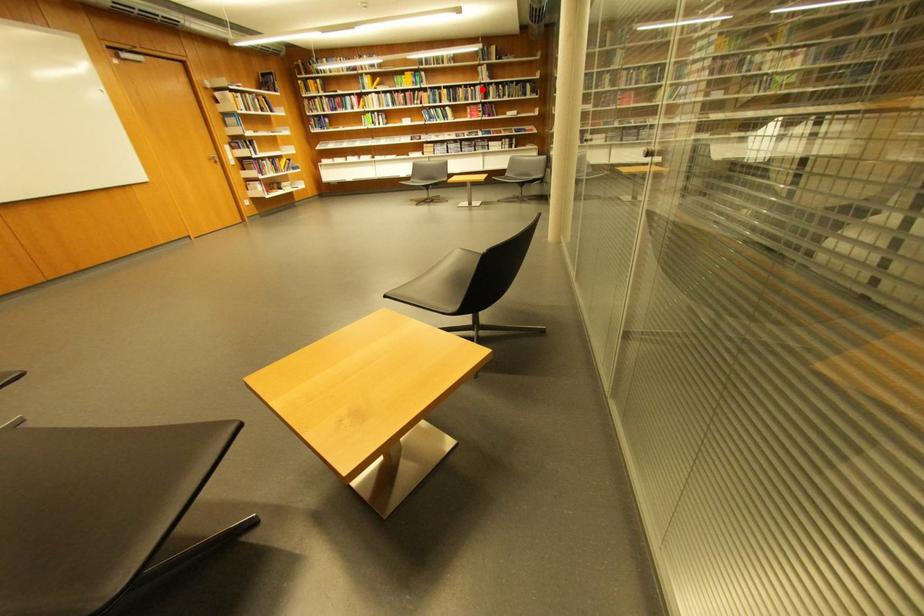
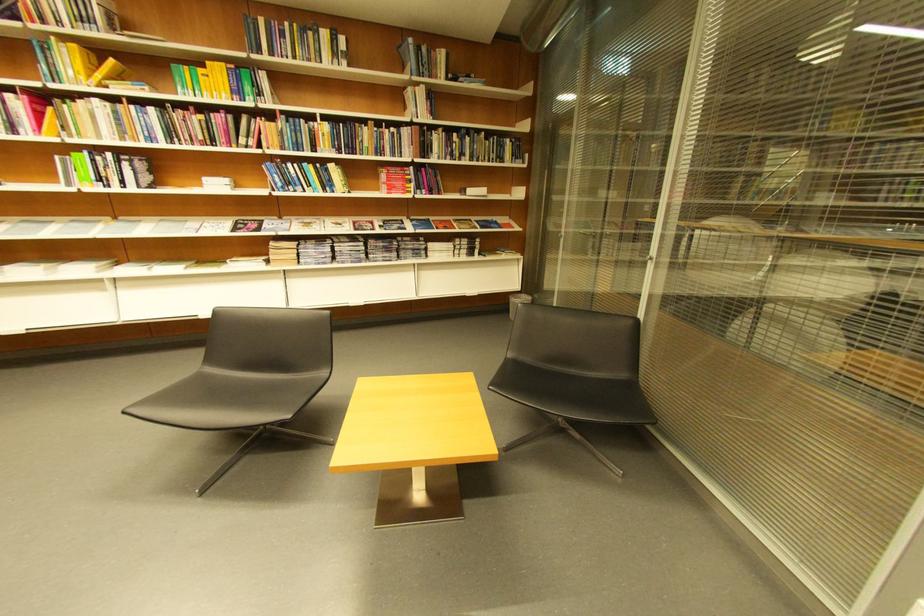
Find the pixel in the second image that matches the highlighted location in the first image.

(403, 131)